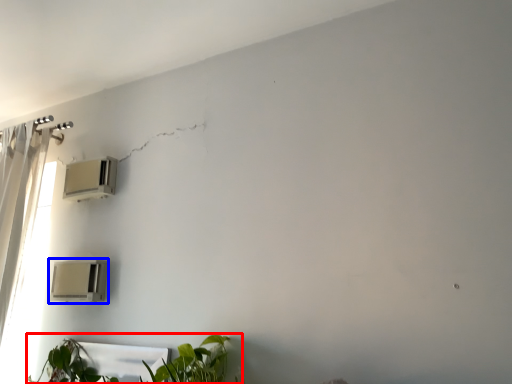
Question: Which object is closer to the camera taking this photo, houseplant (highlighted by a red box) or air conditioning (highlighted by a blue box)?

Choices:
 (A) houseplant
 (B) air conditioning

Answer: (A)